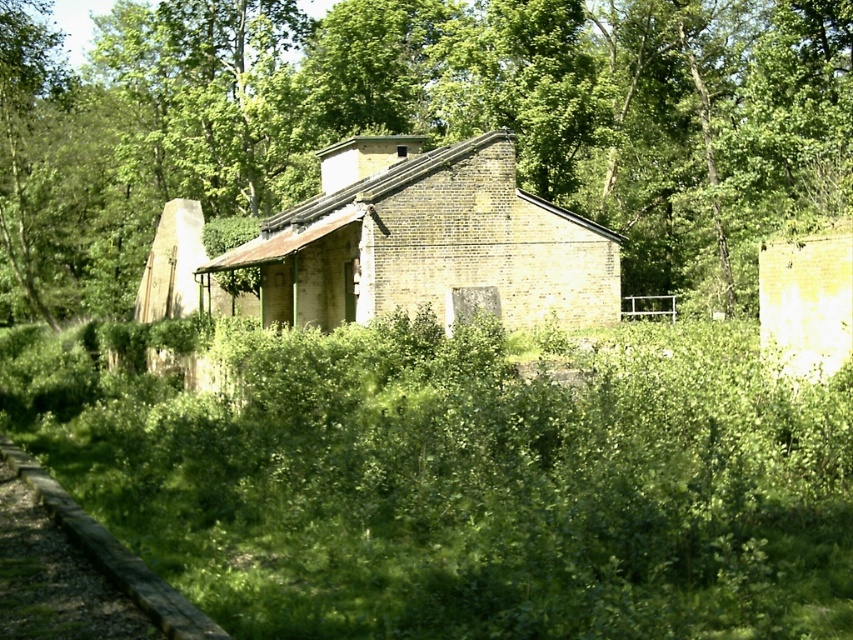
Question: Is green leafy tree at center positioned in front of yellow brick hut at center?

Choices:
 (A) yes
 (B) no

Answer: (B)

Question: Is green leafy tree at center smaller than yellow brick hut at center?

Choices:
 (A) no
 (B) yes

Answer: (A)

Question: In this image, where is green leafy tree at center located relative to yellow brick hut at center?

Choices:
 (A) below
 (B) above

Answer: (B)